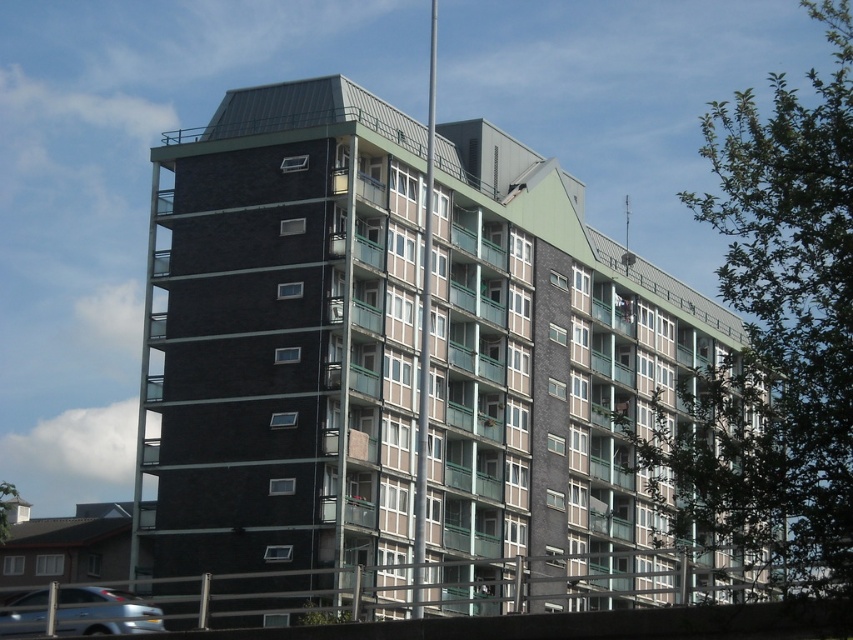
Question: Is dark gray concrete building at center closer to camera compared to green leafy tree at upper right?

Choices:
 (A) no
 (B) yes

Answer: (A)

Question: Which object is closer to the camera taking this photo?

Choices:
 (A) dark gray concrete building at center
 (B) silver metallic car at lower left
 (C) green leafy tree at upper right

Answer: (C)

Question: Considering the relative positions of dark gray concrete building at center and green leafy tree at upper right in the image provided, where is dark gray concrete building at center located with respect to green leafy tree at upper right?

Choices:
 (A) below
 (B) above

Answer: (A)

Question: Among these points, which one is nearest to the camera?

Choices:
 (A) (376, 464)
 (B) (809, 568)

Answer: (B)

Question: Among these points, which one is nearest to the camera?

Choices:
 (A) (838, 364)
 (B) (115, 616)

Answer: (A)

Question: Is dark gray concrete building at center above green leafy tree at upper right?

Choices:
 (A) no
 (B) yes

Answer: (A)